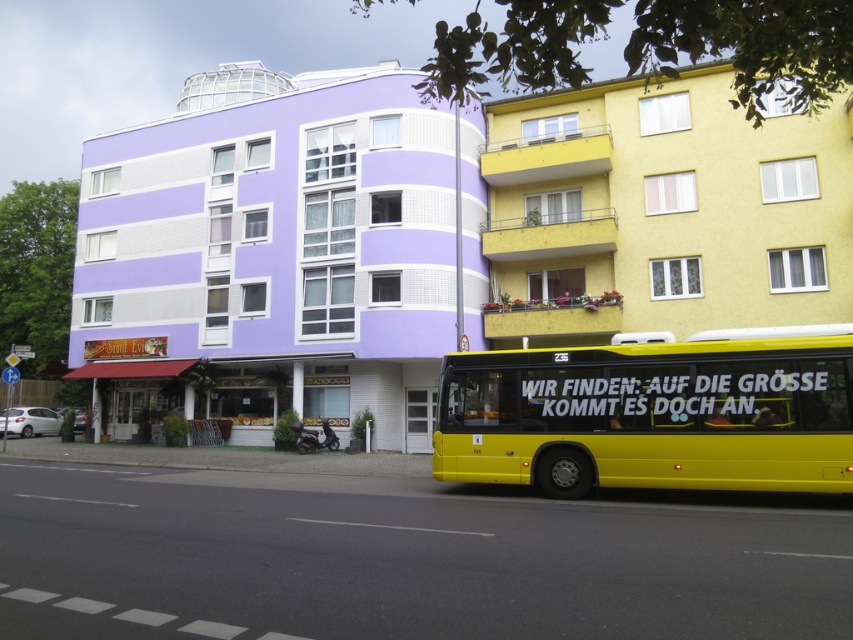
You are a delivery drone that needs to fly from the purple matte building at center to the yellow textured building at upper right. Given that your maximum flight distance is 7 meters, can you complete this delivery without recharging?

The distance between the purple matte building at center and the yellow textured building at upper right is 6.82 meters, which is within your maximum flight distance of 7 meters. Therefore, you can complete the delivery without recharging.

You are a photographer planning to take a photo of the yellow textured building at upper right and the yellow metallic bus at lower right. Since both are yellow, you want to ensure they are distinguishable in the final image. Which object should you focus on to capture more details due to its size?

The yellow textured building at upper right is larger than the yellow metallic bus at lower right, so focusing on the yellow textured building at upper right will allow you to capture more details due to its larger size.